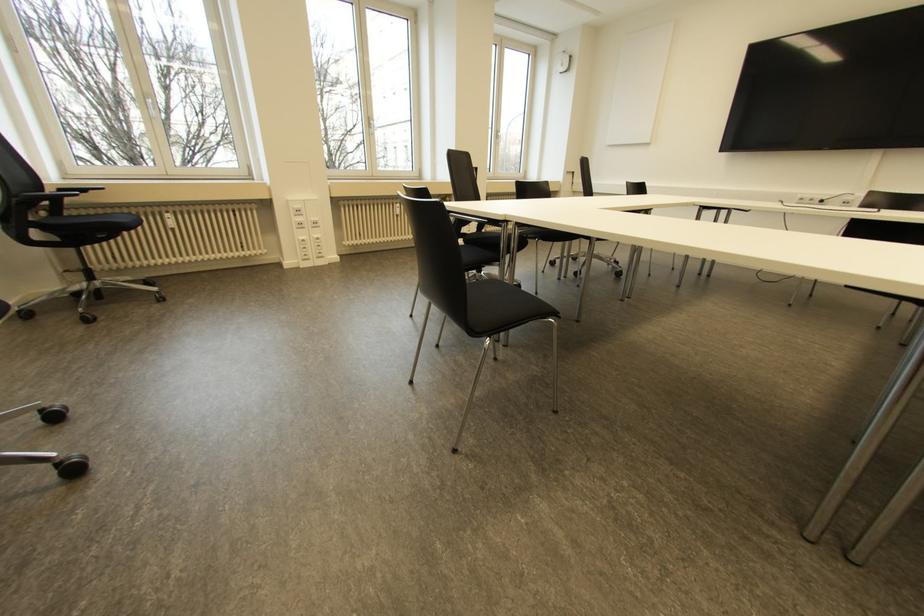
What are the coordinates of `black chair sitting surface` in the screenshot? It's located at (496, 305).